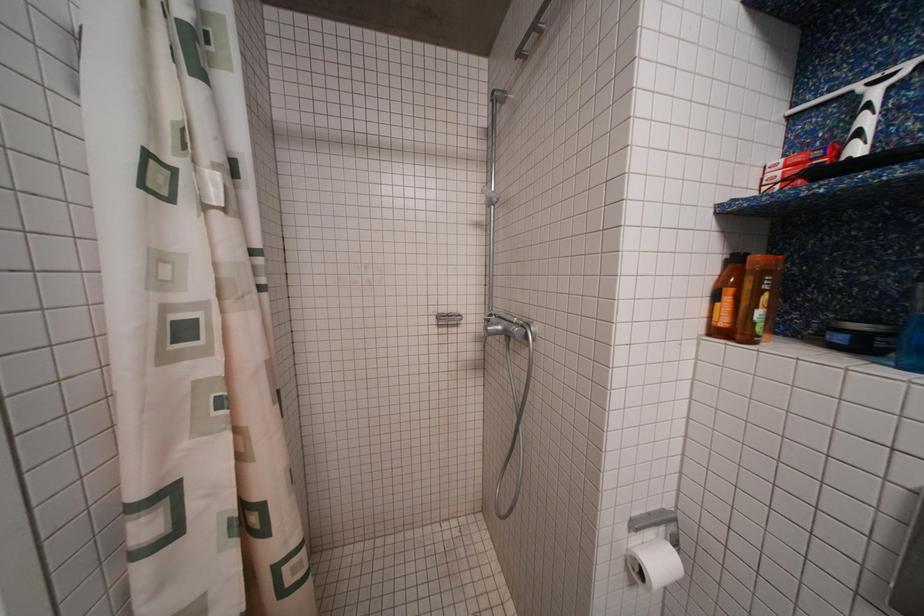
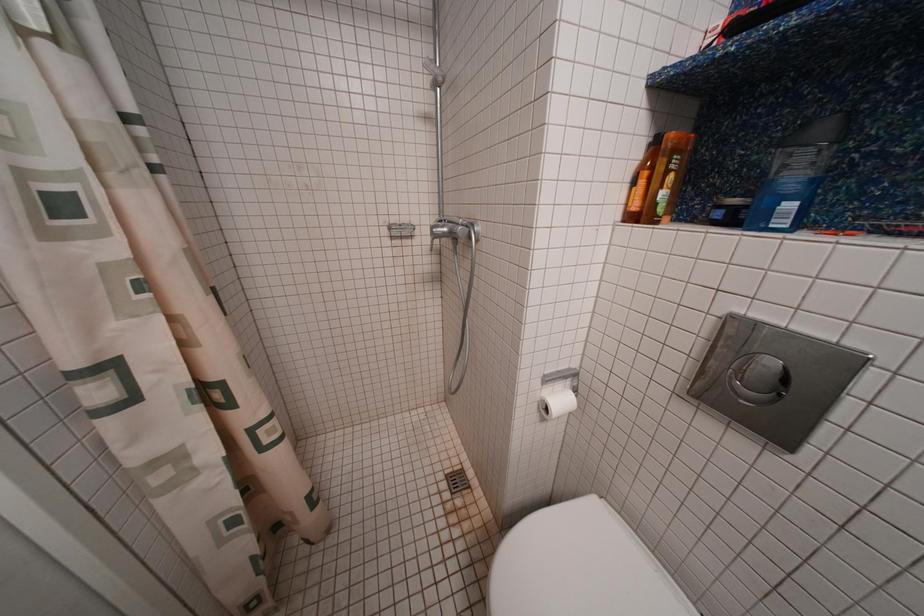
Question: Based on the continuous images, in which direction is the camera rotating? Reply with the corresponding letter.

Choices:
 (A) Left
 (B) Right
 (C) Up
 (D) Down

Answer: (D)